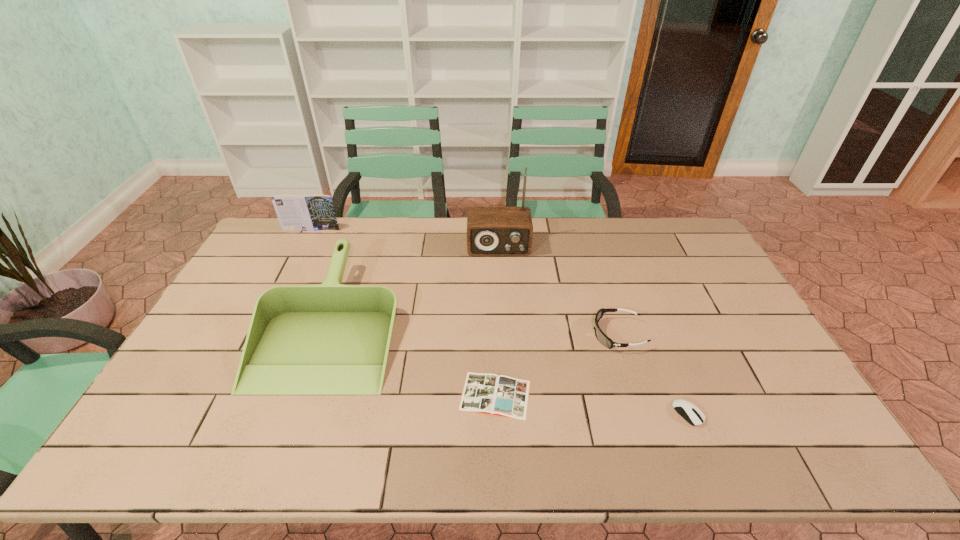
This screenshot has width=960, height=540. Identify the location of the shortest object. (504, 396).

What are the coordinates of `free region located 0.080m on the front-facing side of the tallest object` in the screenshot? It's located at (500, 273).

You are a GUI agent. You are given a task and a screenshot of the screen. Output one action in this format:
    pyautogui.click(x=<x>, y=<y>)
    Task: Click on the vacant space located 0.190m on the front cover of the left book
    
    Given the screenshot: What is the action you would take?
    pyautogui.click(x=295, y=263)

The width and height of the screenshot is (960, 540). What are the coordinates of `free space located on the scoop of the third tallest object` in the screenshot? It's located at (289, 442).

You are a GUI agent. You are given a task and a screenshot of the screen. Output one action in this format:
    pyautogui.click(x=<x>, y=<y>)
    Task: Click on the vacant space located on the front and sides of the third shortest object
    
    Given the screenshot: What is the action you would take?
    pyautogui.click(x=500, y=334)

This screenshot has height=540, width=960. I want to click on free point located on the front and sides of the third shortest object, so click(514, 334).

Locate an element on the screen. free location located 0.390m on the front and sides of the third shortest object is located at coordinates (459, 334).

The height and width of the screenshot is (540, 960). What are the coordinates of `free space located 0.110m on the left of the fifth tallest object` in the screenshot? It's located at (630, 413).

Where is `vacant space situated on the right of the shortest object`? vacant space situated on the right of the shortest object is located at coordinates click(x=668, y=395).

Locate an element on the screen. The height and width of the screenshot is (540, 960). radio receiver at the far edge is located at coordinates (491, 231).